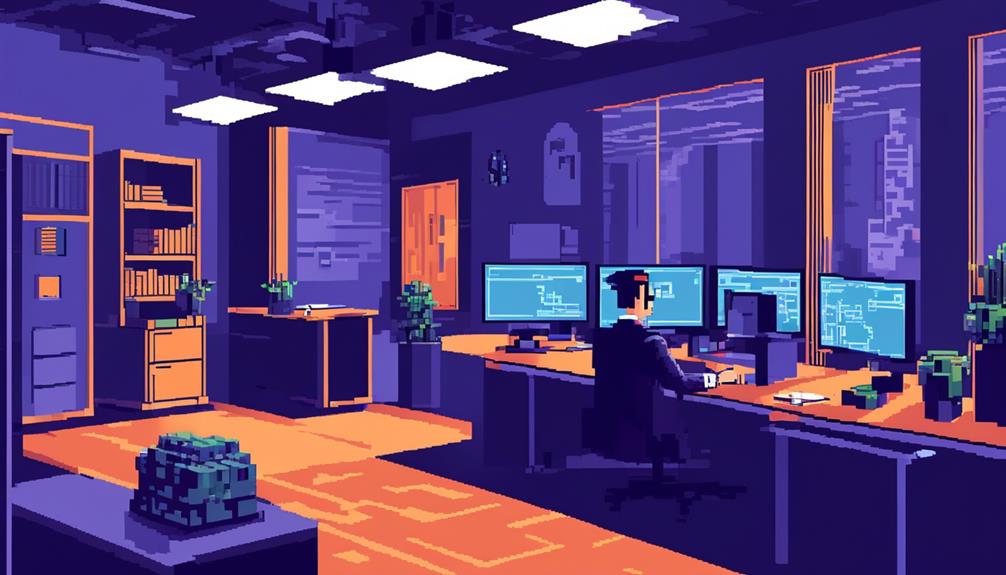
Where is `square lights`? square lights is located at coordinates (238, 118), (314, 95), (438, 76), (566, 30).